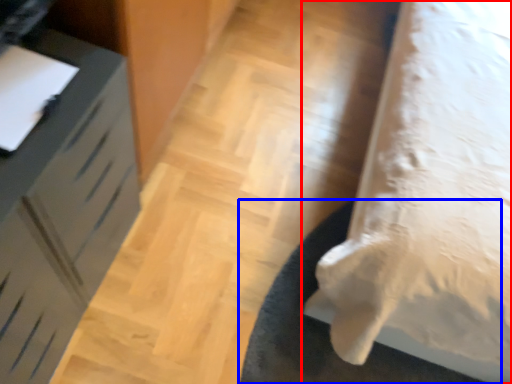
Question: Which object appears closest to the camera in this image, furniture (highlighted by a red box) or mat (highlighted by a blue box)?

Choices:
 (A) furniture
 (B) mat

Answer: (A)